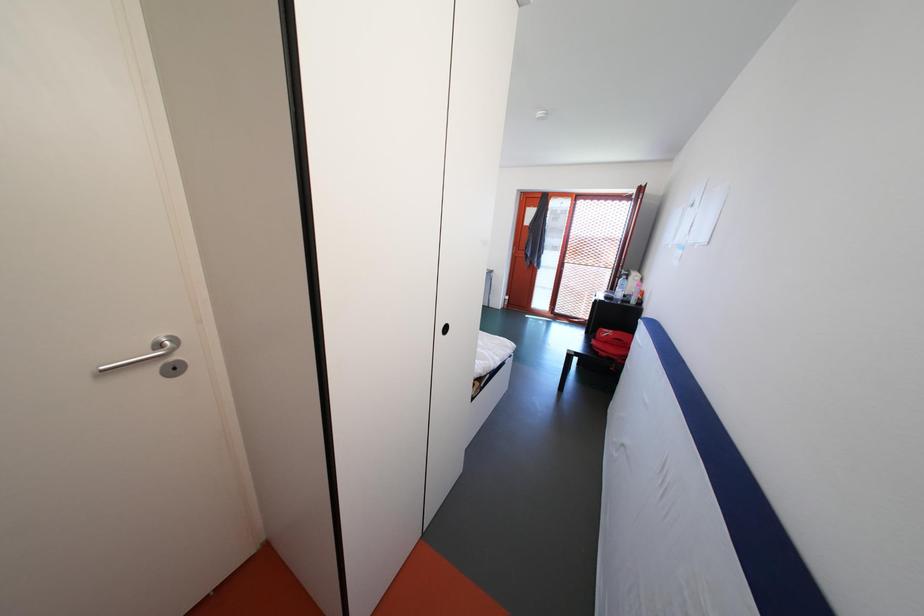
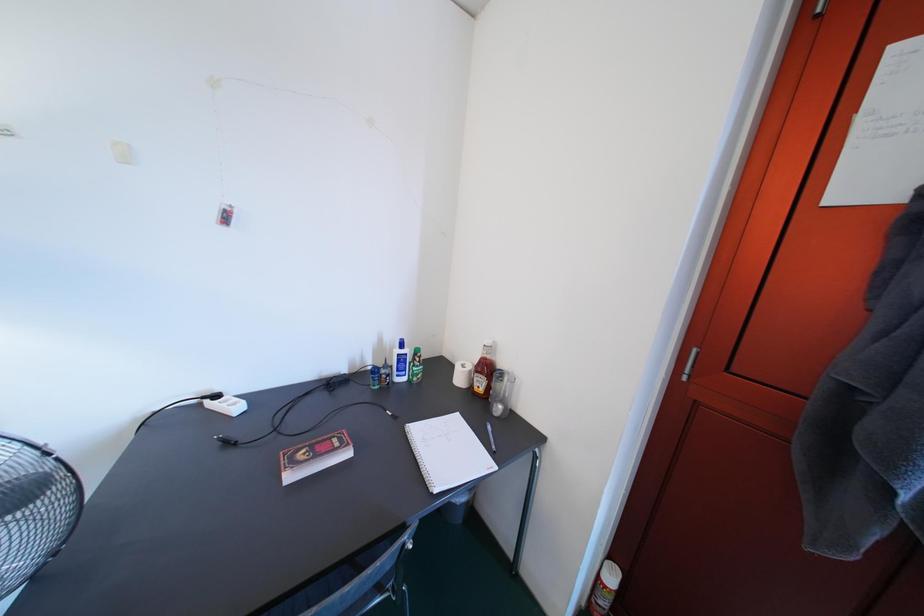
Question: What movement of the cameraman would produce the second image?

Choices:
 (A) Left
 (B) Right
 (C) Forward
 (D) Backward

Answer: (C)